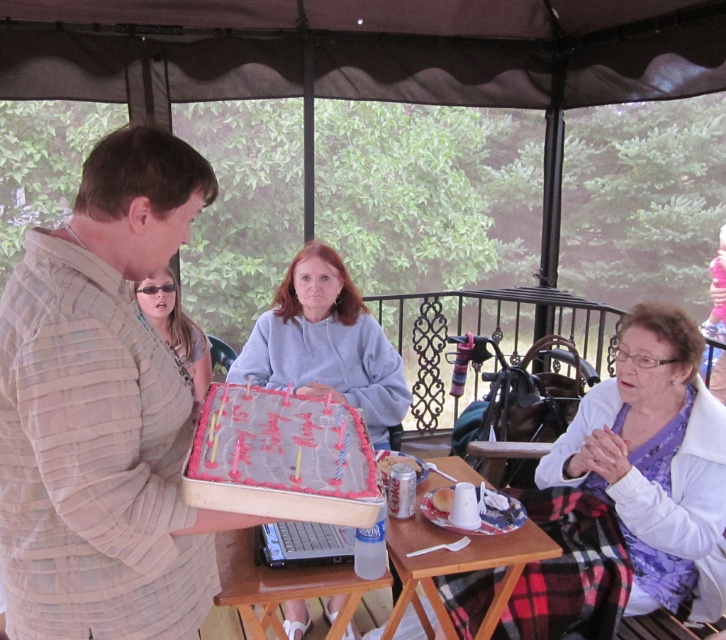
Question: Which object is positioned farthest from the sunglasses at center?

Choices:
 (A) white fabric at lower right
 (B) light beige textured shirt at center

Answer: (A)

Question: Among these objects, which one is nearest to the camera?

Choices:
 (A) sunglasses at center
 (B) light beige textured shirt at center

Answer: (B)

Question: Observing the image, what is the correct spatial positioning of light beige textured shirt at center in reference to pink frosted cake at center?

Choices:
 (A) above
 (B) below

Answer: (A)

Question: Where is matte gray hoodie at center located in relation to sunglasses at center in the image?

Choices:
 (A) below
 (B) above

Answer: (A)

Question: From the image, what is the correct spatial relationship of pink frosted cake at center in relation to wooden picnic table at lower center?

Choices:
 (A) left
 (B) right

Answer: (A)

Question: Estimate the real-world distances between objects in this image. Which object is farther from the wooden picnic table at lower center?

Choices:
 (A) light beige textured shirt at center
 (B) white fabric at lower right

Answer: (A)